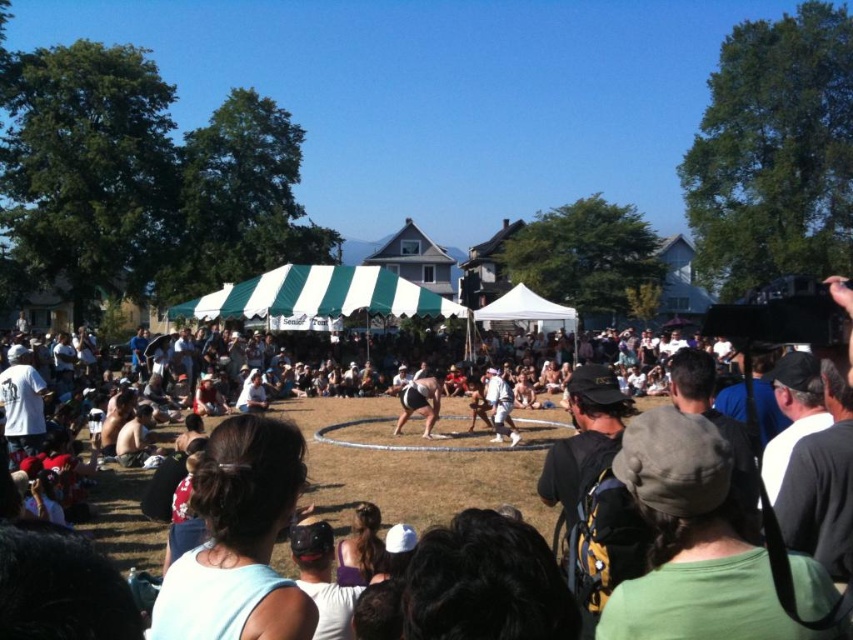
Question: Does dark gray fabric crowd at center come in front of black fabric sumo wrestler at center?

Choices:
 (A) yes
 (B) no

Answer: (A)

Question: Is dark gray fabric crowd at center above black fabric sumo wrestler at center?

Choices:
 (A) no
 (B) yes

Answer: (B)

Question: Estimate the real-world distances between objects in this image. Which object is farther from the dark gray fabric crowd at center?

Choices:
 (A) green striped canopy at center
 (B) black fabric sumo wrestler at center

Answer: (A)

Question: Which object is positioned farthest from the green striped canopy at center?

Choices:
 (A) black fabric sumo wrestler at center
 (B) dark gray fabric crowd at center

Answer: (A)

Question: Which of these objects is positioned closest to the black fabric sumo wrestler at center?

Choices:
 (A) dark gray fabric crowd at center
 (B) green striped canopy at center

Answer: (A)

Question: Is green striped canopy at center further to the viewer compared to black fabric sumo wrestler at center?

Choices:
 (A) no
 (B) yes

Answer: (B)